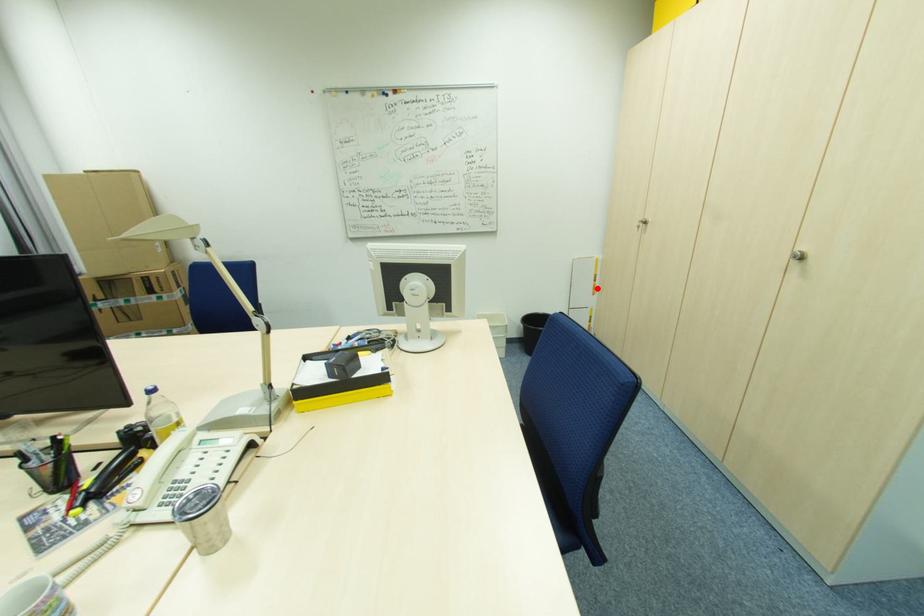
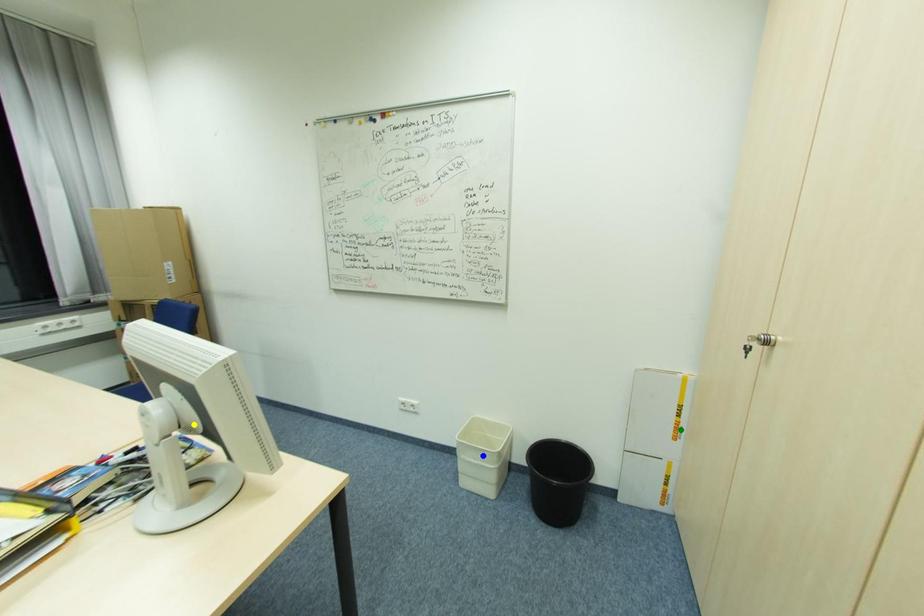
Question: I am providing you with two images of the same scene from different viewpoints. A red point is marked on the first image. You are given multiple points on the second image. In image 2, which mark is for the same physical point as the one in image 1?

Choices:
 (A) blue point
 (B) green point
 (C) yellow point

Answer: (B)